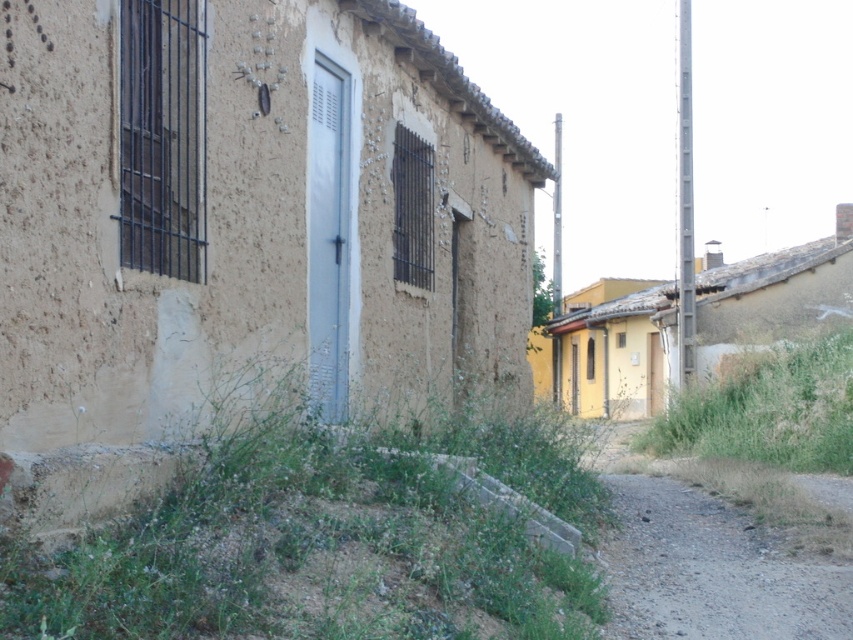
You are a gardener trying to decide where to plant new flowers. The scene has green grass at lower center and gray gravel path at lower right. Which area has a wider space for planting?

The green grass at lower center has a wider space for planting since its width surpasses that of the gray gravel path at lower right.

You are a gardener who needs to mow the lawn. You see the green grass at lower center and the gray gravel path at lower right. Which area requires mowing?

The green grass at lower center requires mowing because it is much taller than the gray gravel path at lower right.